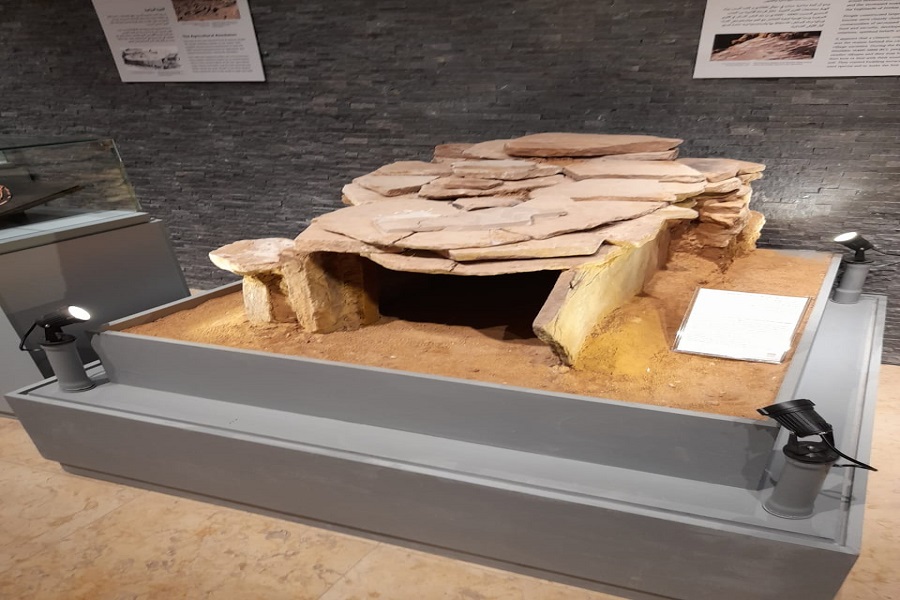
This screenshot has height=600, width=900. In order to click on floor in this screenshot , I will do `click(218, 557)`.